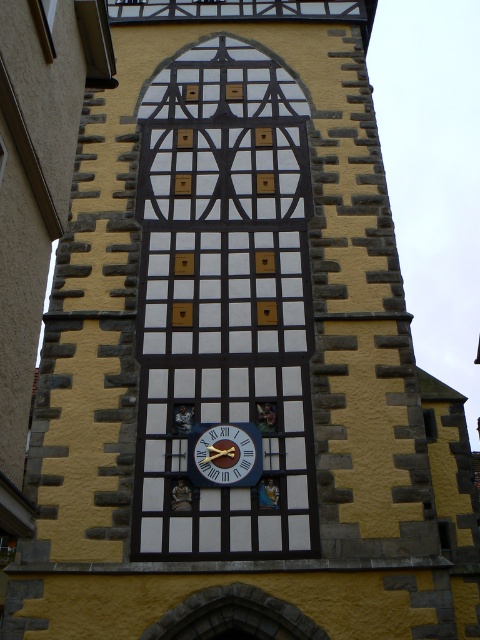
Which is behind, point (276, 321) or point (229, 451)?

Point (276, 321)

Does point (187, 300) come farther from viewer compared to point (252, 452)?

Yes, point (187, 300) is behind point (252, 452).

This screenshot has width=480, height=640. In order to click on white painted wood at center in this screenshot , I will do `click(224, 301)`.